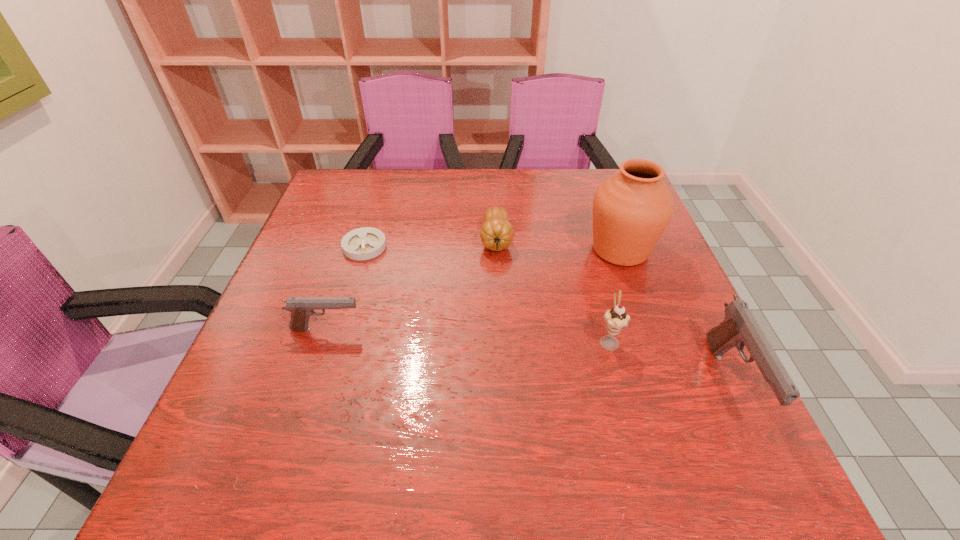
Where is `the shorter pistol`? This screenshot has width=960, height=540. the shorter pistol is located at coordinates (301, 308).

Where is `the left pistol`? The image size is (960, 540). the left pistol is located at coordinates (301, 308).

The height and width of the screenshot is (540, 960). I want to click on the taller pistol, so click(x=739, y=328).

Locate an element on the screen. the nearer pistol is located at coordinates (739, 328).

Where is `ashtray`? The image size is (960, 540). ashtray is located at coordinates (364, 243).

I want to click on the tallest object, so click(631, 209).

Where is `the third object from left to right`? This screenshot has height=540, width=960. the third object from left to right is located at coordinates (496, 233).

The height and width of the screenshot is (540, 960). What are the coordinates of `icecream` in the screenshot? It's located at (616, 318).

This screenshot has width=960, height=540. What are the coordinates of `vacant space situated at the barrel of the shorter pistol` in the screenshot? It's located at (472, 329).

This screenshot has height=540, width=960. Identify the location of vacant space located on the right of the ashtray. (476, 246).